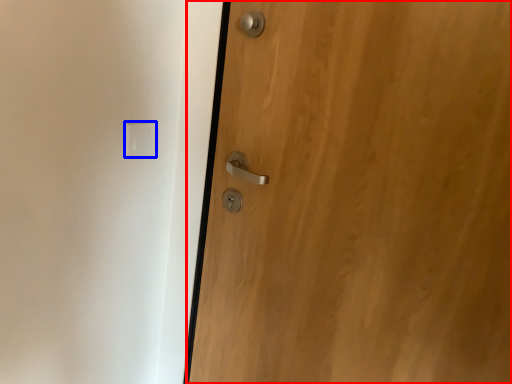
Question: Which object appears closest to the camera in this image, door (highlighted by a red box) or light switch (highlighted by a blue box)?

Choices:
 (A) door
 (B) light switch

Answer: (A)